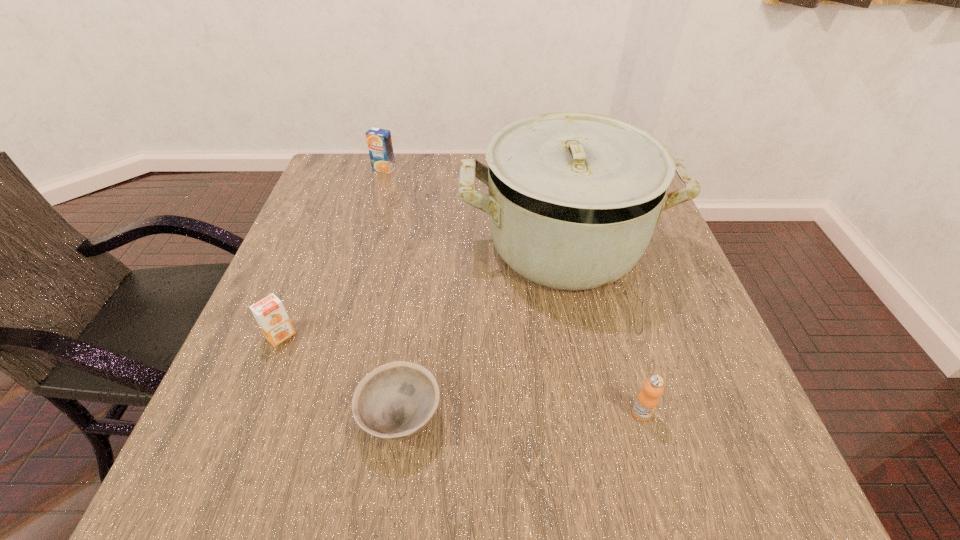
Where is `saucepan`? This screenshot has height=540, width=960. saucepan is located at coordinates (573, 198).

Identify the location of the tallest object. (573, 198).

The height and width of the screenshot is (540, 960). I want to click on the farthest orange juice, so click(x=379, y=141).

Find the location of a particular element. the second object from left to right is located at coordinates (379, 141).

This screenshot has width=960, height=540. Identify the location of the nearest orange juice. (647, 400).

Identify the location of the second farthest orange juice. The height and width of the screenshot is (540, 960). (269, 312).

Where is `the leftmost object`? This screenshot has width=960, height=540. the leftmost object is located at coordinates (269, 312).

Find the location of a particular element. This screenshot has width=960, height=540. the third object from left to right is located at coordinates (394, 402).

At what (x,y) coordinates should I click in order to perform the action: click on the shortest object. Please return your answer as a coordinate pair (x, y). Looking at the image, I should click on (394, 402).

The height and width of the screenshot is (540, 960). In order to click on vacant space located on the left of the fourth nearest object in this screenshot , I will do `click(420, 245)`.